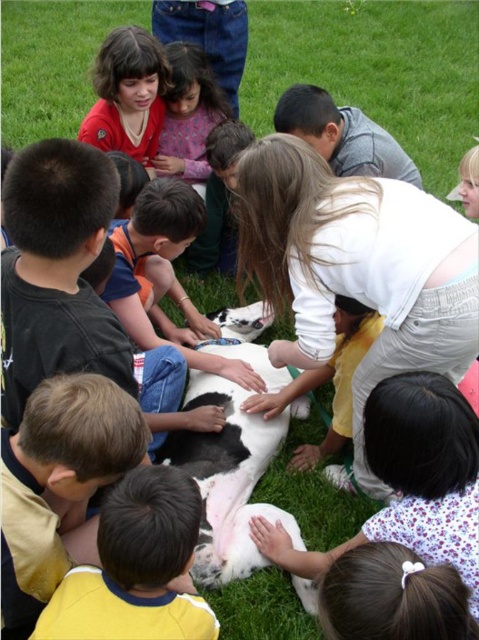
You are a photographer standing at the center of the scene. You want to take a photo that includes both the yellow jersey at lower left and the matte red shirt at upper left. Given that your camera has a 6 feet wide lens, can you capture both in a single shot without moving?

The yellow jersey at lower left and the matte red shirt at upper left are 7.41 feet apart from each other. Since the camera lens can only capture 6 feet wide, you cannot capture both in a single shot without moving.

You are a photographer trying to capture a group photo of the children and the calf. You notice the white fluffy dog at lower center and the yellow jersey at lower left in the frame. Based on their sizes, which object would appear more prominent in the photo?

The white fluffy dog at lower center would appear more prominent in the photo because it has a larger size compared to the yellow jersey at lower left.